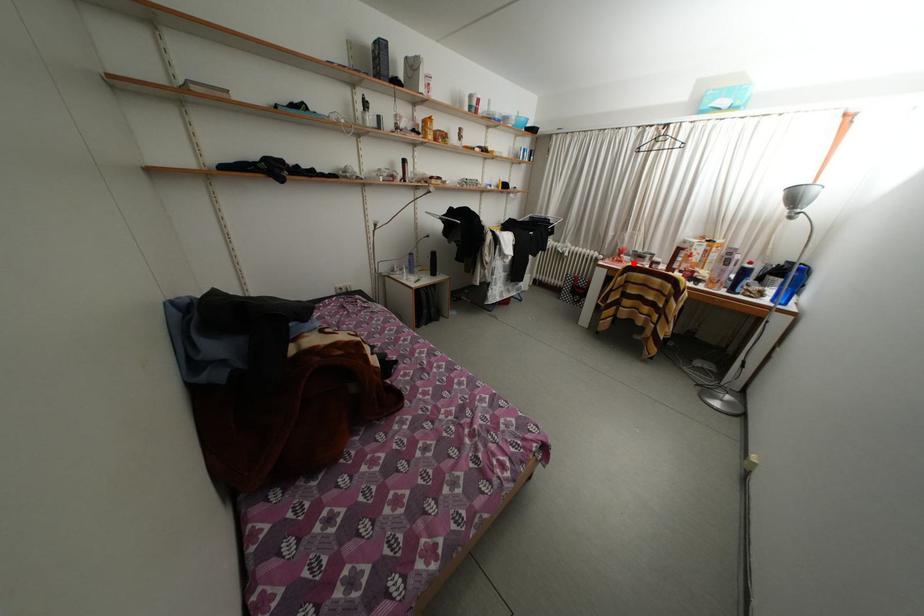
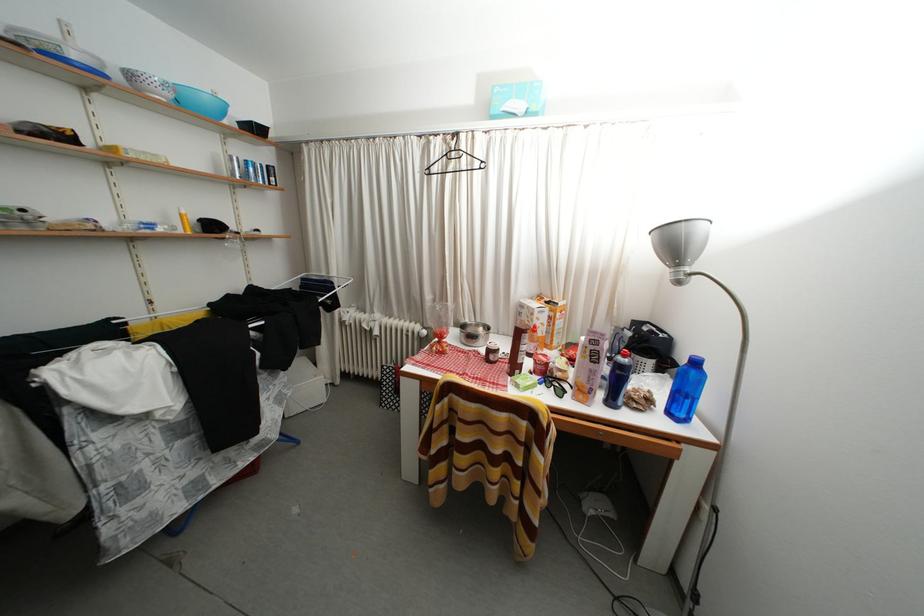
In the second image, find the point that corresponds to the highlighted location in the first image.

(460, 342)